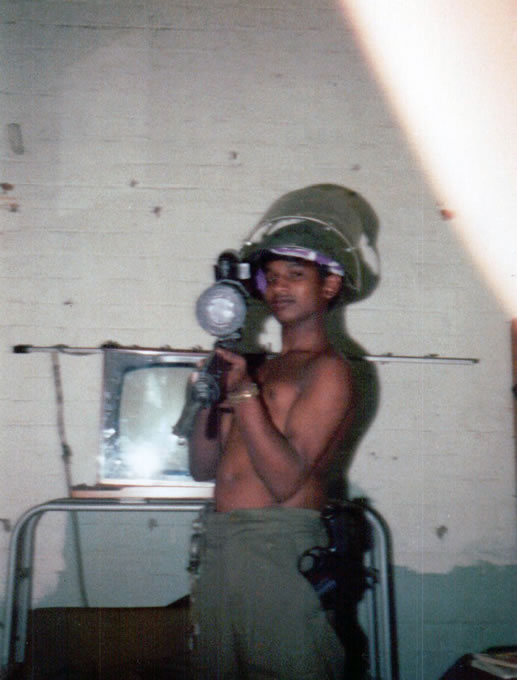
The height and width of the screenshot is (680, 517). Identify the location of glass case. (112, 440).